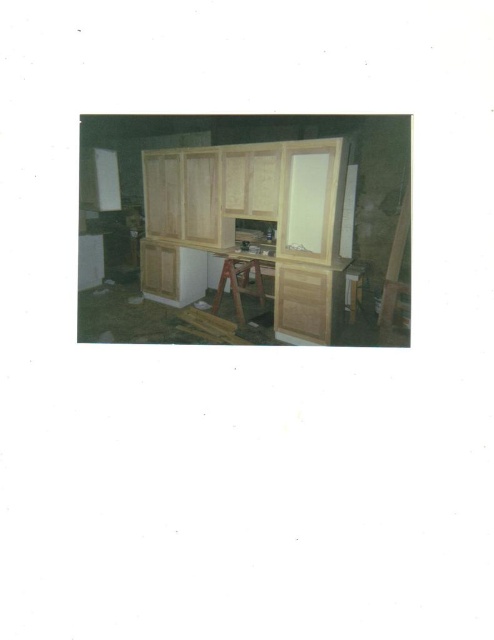
Between point (409, 284) and point (241, 320), which one is positioned in front?

Positioned in front is point (409, 284).

Which is behind, point (379, 339) or point (223, 259)?

Point (223, 259)

Who is more forward, (399,211) or (239,262)?

Point (239,262)

This screenshot has width=494, height=640. In order to click on wooden ladder at right in this screenshot , I will do `click(397, 280)`.